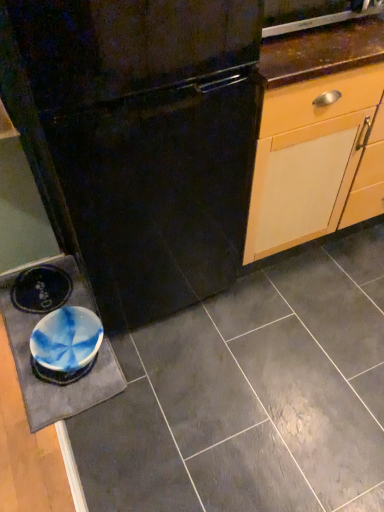
You are a GUI agent. You are given a task and a screenshot of the screen. Output one action in this format:
    pyautogui.click(x=<x>, y=<y>)
    Task: Click on the free point in front of blue marbled slate at lower left
    The width and height of the screenshot is (384, 512).
    Given the screenshot: What is the action you would take?
    pyautogui.click(x=75, y=454)